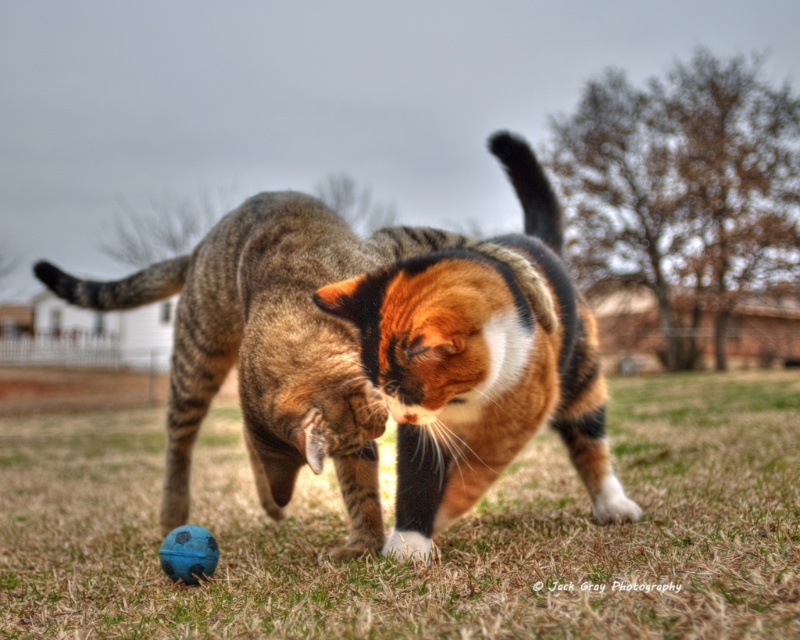
Does green grass at center have a lesser height compared to calico fur cat at center?

Correct, green grass at center is not as tall as calico fur cat at center.

What do you see at coordinates (434, 540) in the screenshot?
I see `green grass at center` at bounding box center [434, 540].

Measure the distance between green grass at center and camera.

2.05 meters

Find the location of a particular element. green grass at center is located at coordinates (434, 540).

Who is positioned more to the left, green grass at center or blue rubber ball at lower left?

blue rubber ball at lower left

Can you confirm if green grass at center is wider than blue rubber ball at lower left?

Indeed, green grass at center has a greater width compared to blue rubber ball at lower left.

Image resolution: width=800 pixels, height=640 pixels. What do you see at coordinates (434, 540) in the screenshot? I see `green grass at center` at bounding box center [434, 540].

Identify the location of green grass at center. (434, 540).

Is point (358, 300) less distant than point (172, 568)?

Yes.

Can you confirm if calico fur cat at center is positioned above blue rubber ball at lower left?

Indeed, calico fur cat at center is positioned over blue rubber ball at lower left.

Where is `calico fur cat at center`? calico fur cat at center is located at coordinates (480, 365).